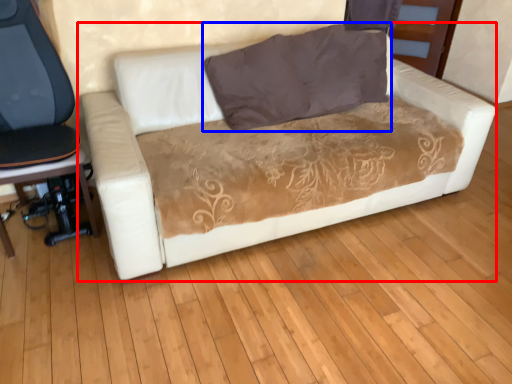
Question: Which point is closer to the camera, studio couch (highlighted by a red box) or pillow (highlighted by a blue box)?

Choices:
 (A) studio couch
 (B) pillow

Answer: (A)